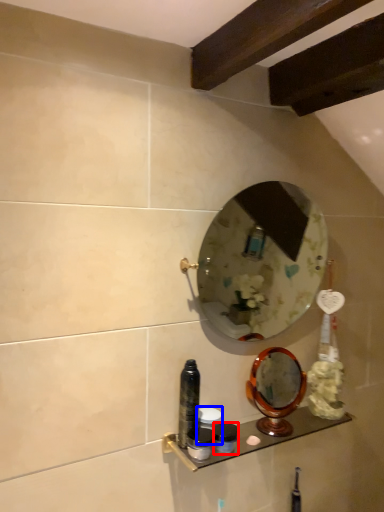
Question: Which object appears farthest to the camera in this image, toiletry (highlighted by a red box) or toiletry (highlighted by a blue box)?

Choices:
 (A) toiletry
 (B) toiletry

Answer: (B)